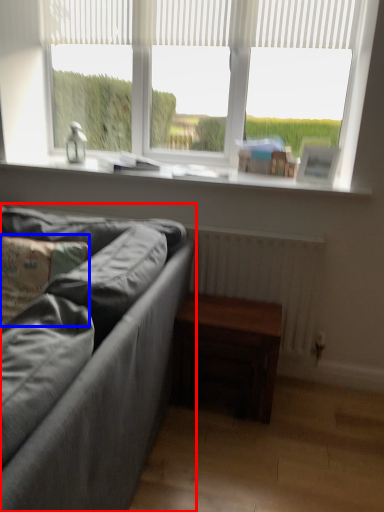
Question: Which object is further to the camera taking this photo, studio couch (highlighted by a red box) or pillow (highlighted by a blue box)?

Choices:
 (A) studio couch
 (B) pillow

Answer: (B)